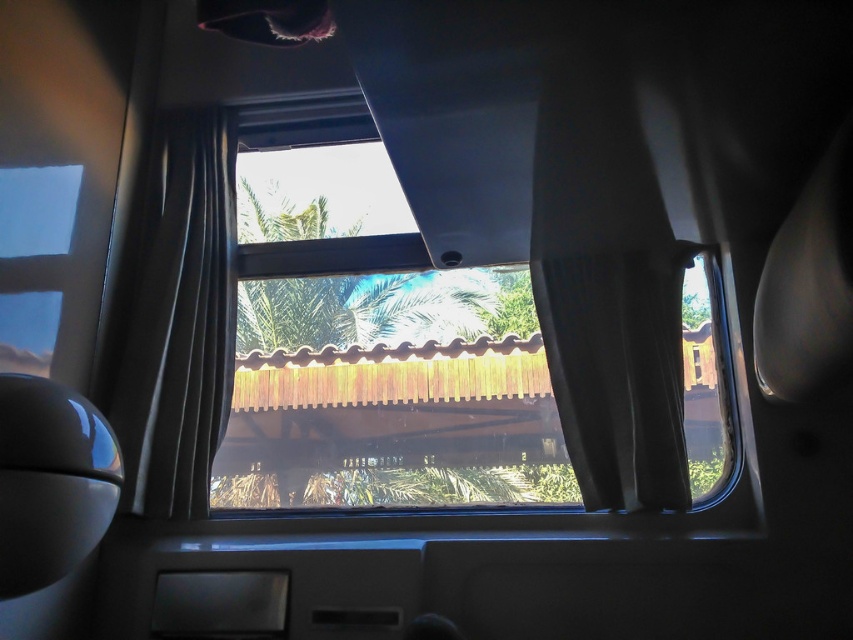
Question: Which object is positioned closest to the black velvet curtain at right?

Choices:
 (A) green leafy palm tree at center
 (B) transparent glass window at center

Answer: (B)

Question: Is transparent glass window at center positioned behind green leafy palm tree at center?

Choices:
 (A) yes
 (B) no

Answer: (B)

Question: Which of the following is the farthest from the observer?

Choices:
 (A) black fabric curtain at center
 (B) black velvet curtain at right
 (C) green leafy palm tree at center

Answer: (C)

Question: Does transparent glass window at center have a greater width compared to black velvet curtain at right?

Choices:
 (A) yes
 (B) no

Answer: (A)

Question: Among these objects, which one is nearest to the camera?

Choices:
 (A) transparent glass window at center
 (B) green leafy palm tree at center
 (C) black velvet curtain at right

Answer: (C)

Question: Can you confirm if black velvet curtain at right is thinner than green leafy palm tree at center?

Choices:
 (A) yes
 (B) no

Answer: (A)